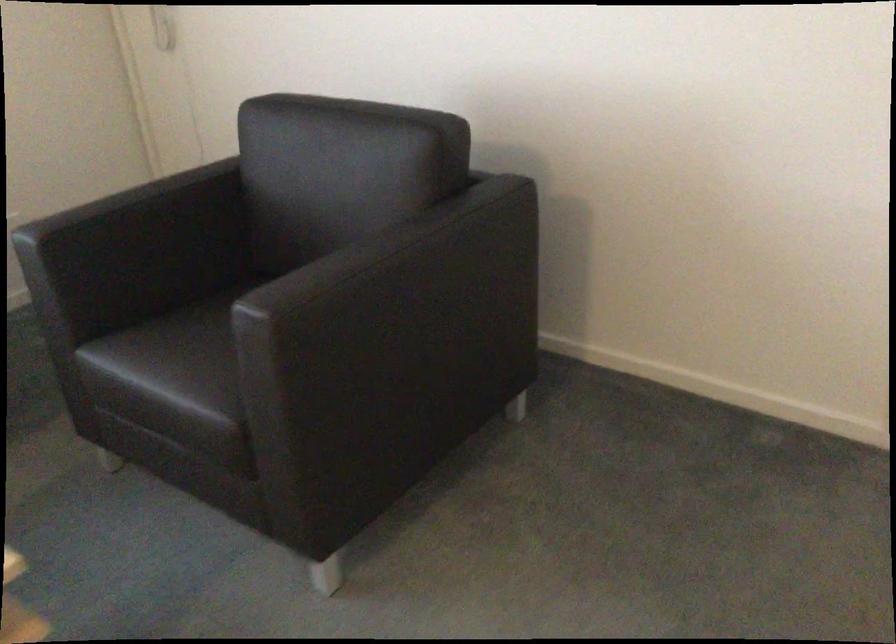
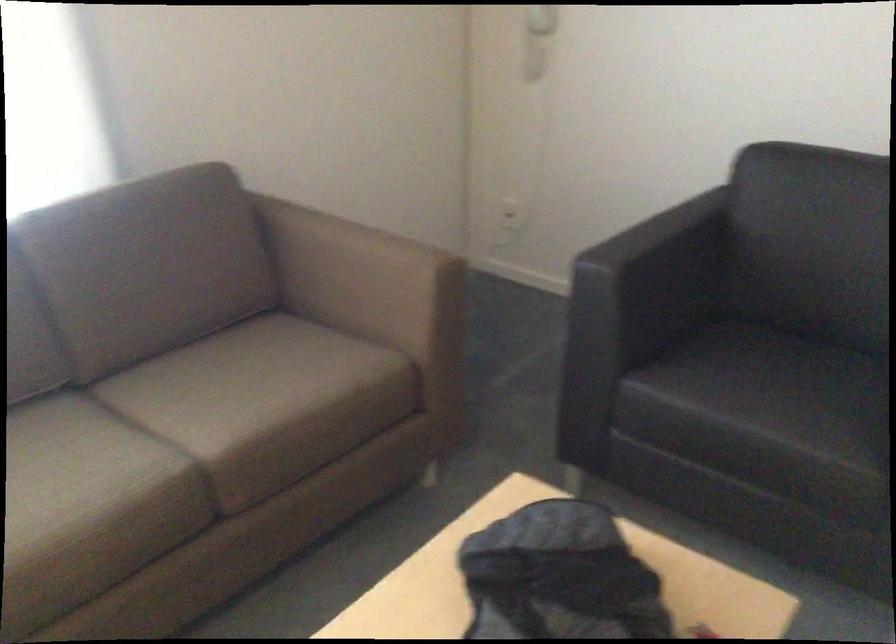
The point at (117,239) is marked in the first image. Where is the corresponding point in the second image?

(652, 270)